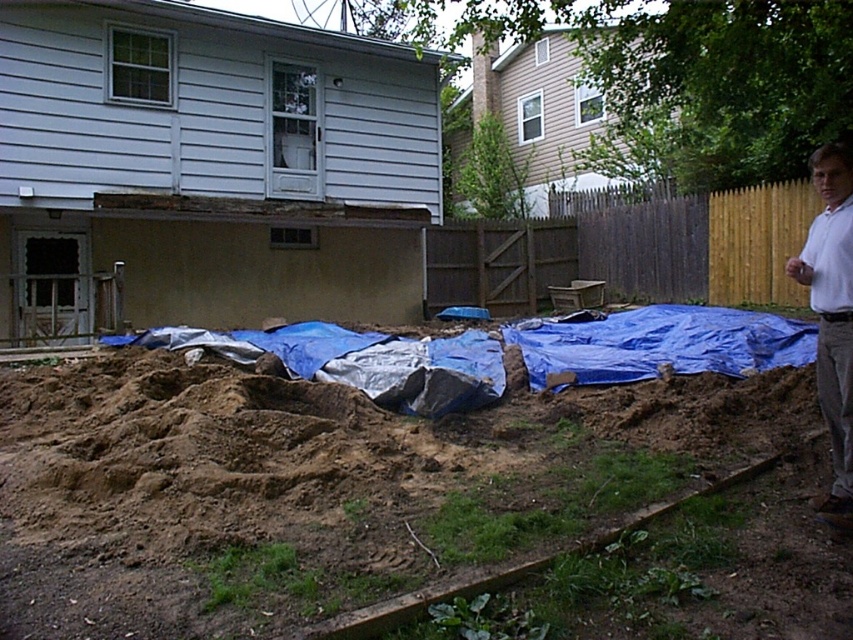
Can you confirm if brown soil at lower left is positioned below white cotton shirt at right?

Correct, brown soil at lower left is located below white cotton shirt at right.

Between brown soil at lower left and white cotton shirt at right, which one has less height?

brown soil at lower left is shorter.

Does point (370, 461) lie in front of point (843, 410)?

That is False.

What are the coordinates of `brown soil at lower left` in the screenshot? It's located at (323, 483).